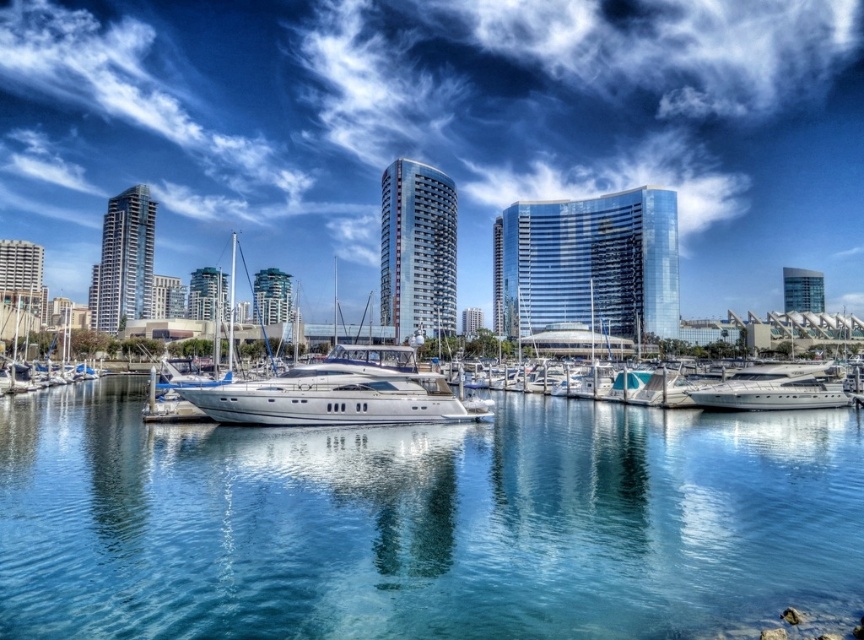
Question: Which is nearer to the glossy glass building at center?

Choices:
 (A) glassy blue skyscraper at upper right
 (B) glossy glass tower at center
 (C) matte glass skyscraper at left
 (D) glassy blue skyscraper at center

Answer: (B)

Question: Considering the relative positions of clear glass water at center and matte glass skyscraper at left in the image provided, where is clear glass water at center located with respect to matte glass skyscraper at left?

Choices:
 (A) above
 (B) below

Answer: (B)

Question: Estimate the real-world distances between objects in this image. Which object is closer to the clear glass water at center?

Choices:
 (A) glassy blue skyscraper at center
 (B) white glossy yacht at center

Answer: (B)

Question: Where is glossy glass building at center located in relation to glassy blue skyscraper at center in the image?

Choices:
 (A) right
 (B) left

Answer: (A)

Question: Which point is farther to the camera?

Choices:
 (A) (796, 288)
 (B) (423, 317)

Answer: (A)

Question: Can you confirm if glossy glass building at center is positioned above glossy glass tower at center?

Choices:
 (A) yes
 (B) no

Answer: (B)